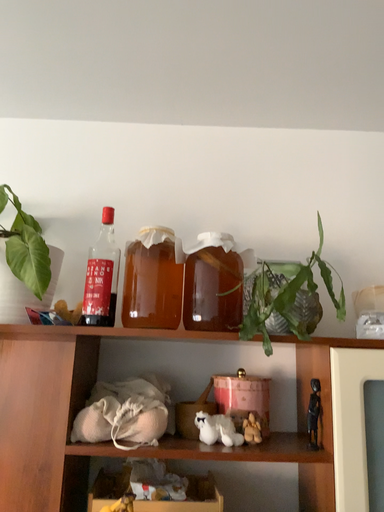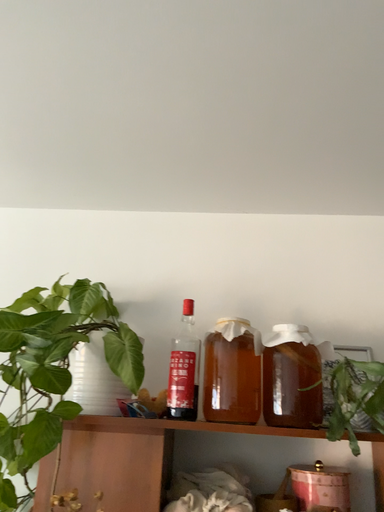
Question: How did the camera likely rotate when shooting the video?

Choices:
 (A) rotated upward
 (B) rotated downward

Answer: (A)